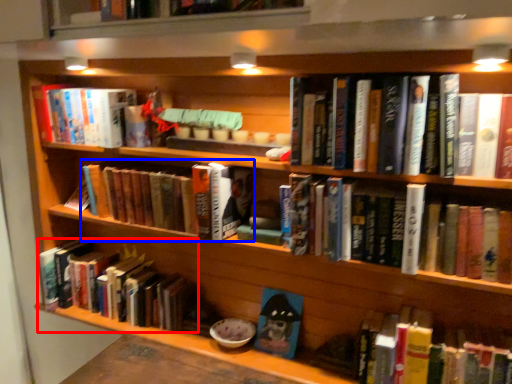
Question: Among these objects, which one is nearest to the camera, book (highlighted by a red box) or book (highlighted by a blue box)?

Choices:
 (A) book
 (B) book

Answer: (B)